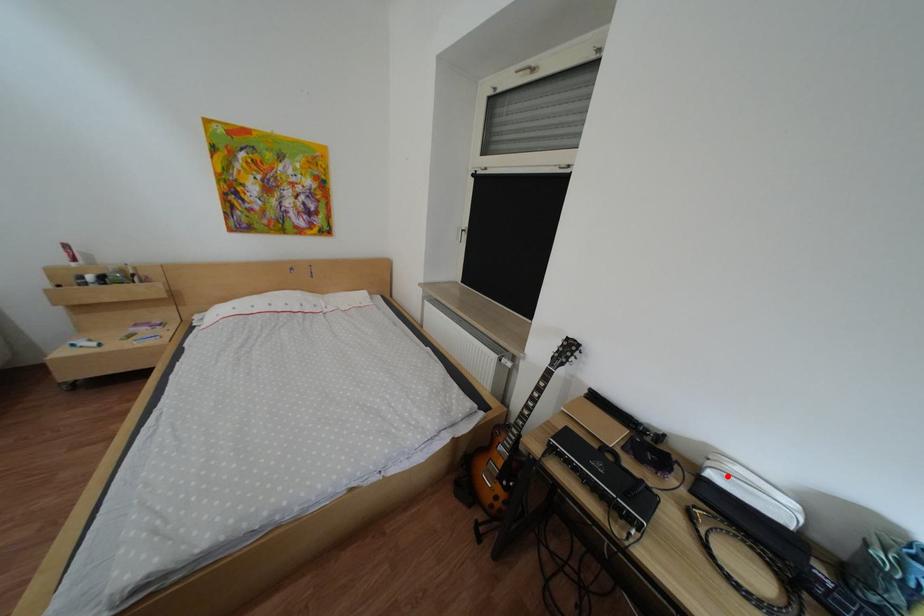
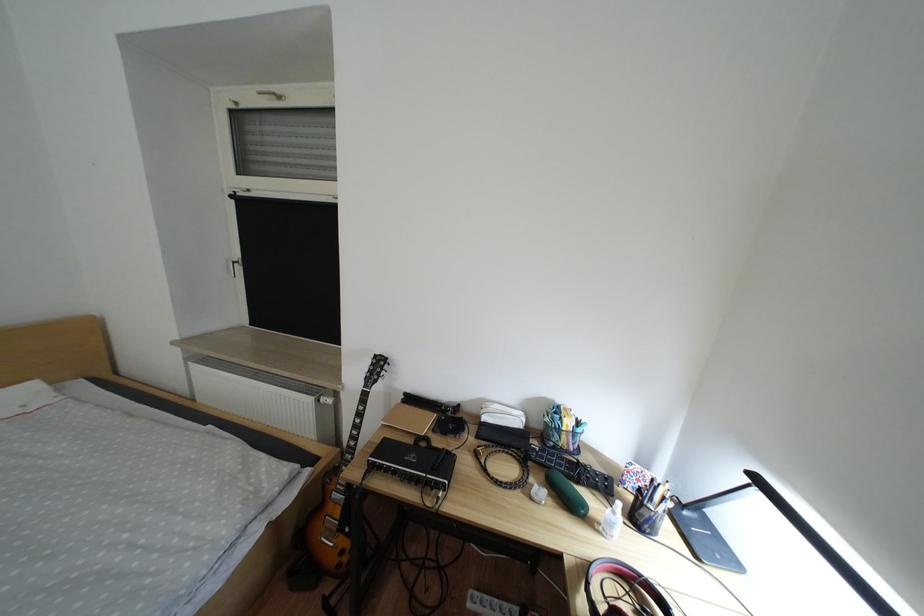
Locate, in the second image, the point that corresponds to the highlighted location in the first image.

(501, 419)